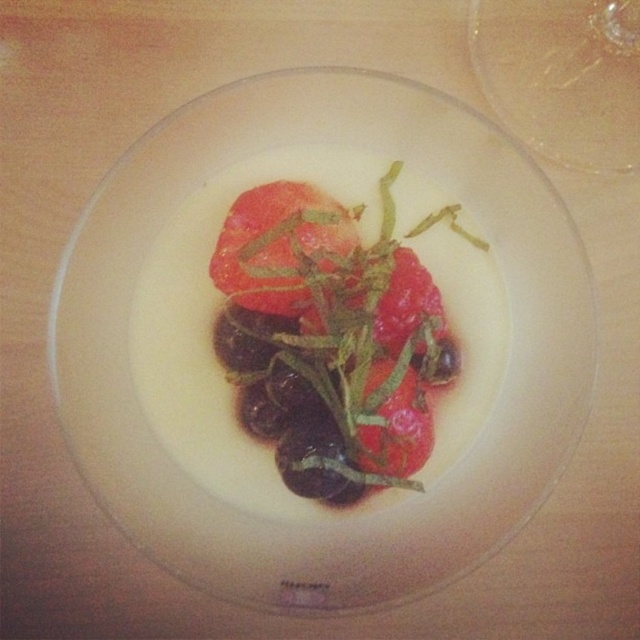
Question: Which point is farther from the camera taking this photo?

Choices:
 (A) (364, 576)
 (B) (385, 376)

Answer: (B)

Question: Is white glossy platter at center above matte white salad at center?

Choices:
 (A) no
 (B) yes

Answer: (A)

Question: Does white glossy platter at center appear over glossy red tomato at center?

Choices:
 (A) no
 (B) yes

Answer: (A)

Question: Does matte white salad at center appear over glossy red tomato at center?

Choices:
 (A) no
 (B) yes

Answer: (A)

Question: Which object is closer to the camera taking this photo?

Choices:
 (A) matte white salad at center
 (B) white glossy platter at center
 (C) glossy red tomato at center

Answer: (B)

Question: Which point appears farthest from the camera in this image?

Choices:
 (A) (83, 356)
 (B) (266, 292)
 (C) (307, 376)

Answer: (B)